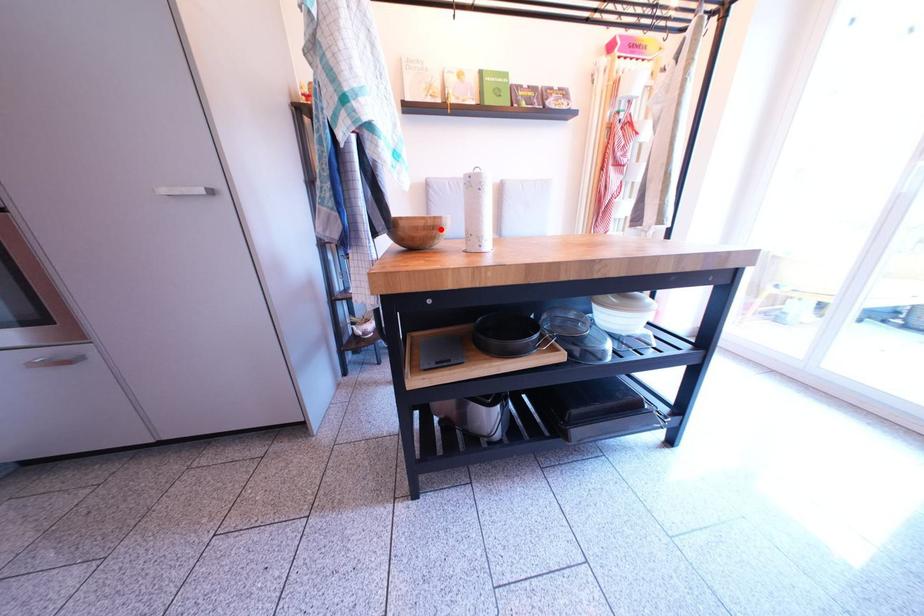
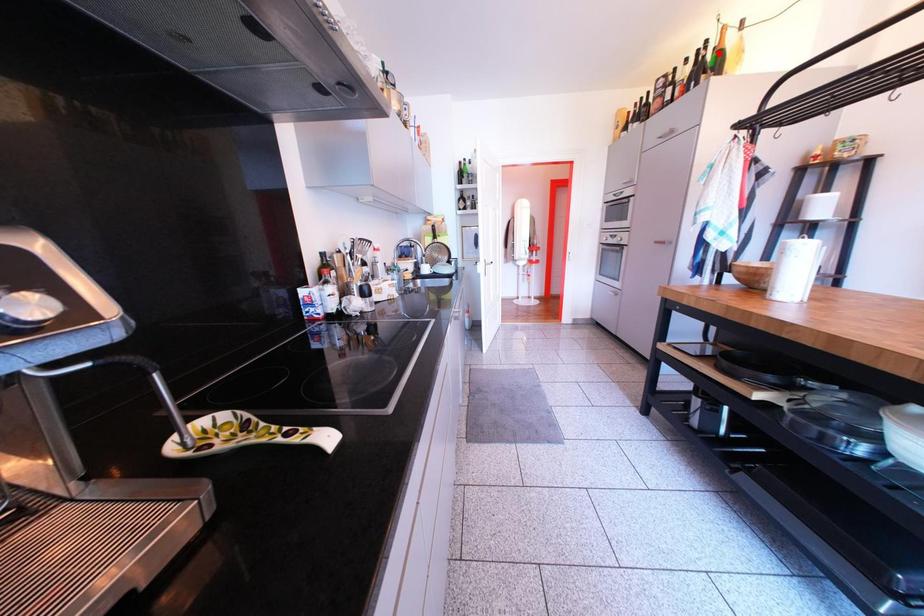
I am providing you with two images of the same scene from different viewpoints. A red point is marked on the first image and another point is marked on the second image. Is the marked point in image1 the same physical position as the marked point in image2?

No